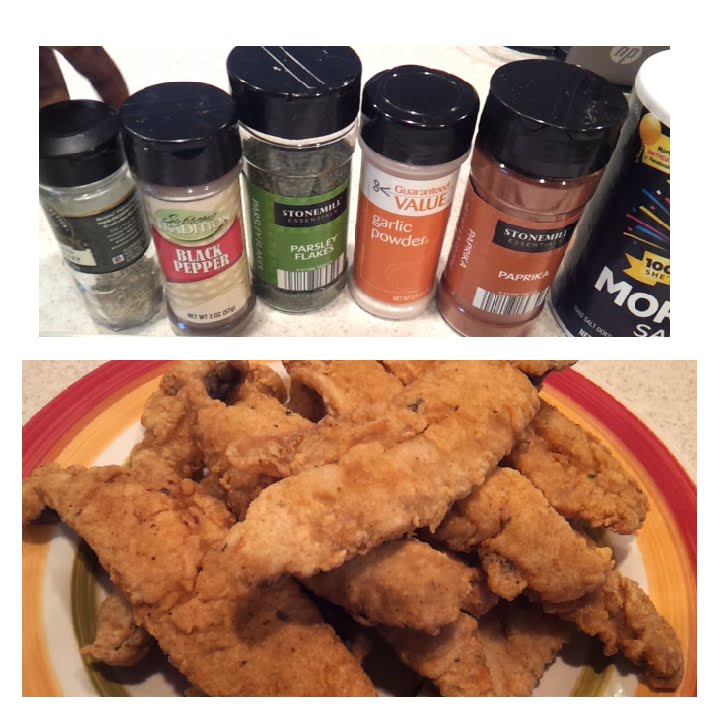
The image size is (720, 720). I want to click on paprika spice container, so click(x=521, y=246).